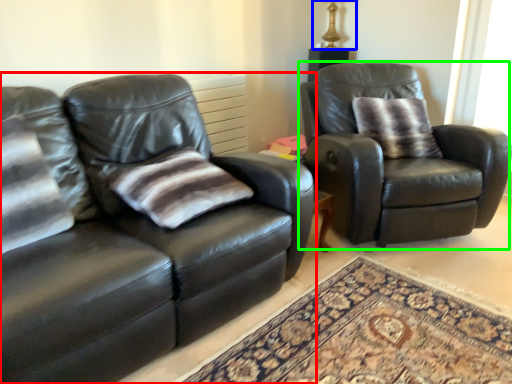
Question: Which is nearer to the studio couch (highlighted by a red box)? table lamp (highlighted by a blue box) or chair (highlighted by a green box).

Choices:
 (A) table lamp
 (B) chair

Answer: (B)